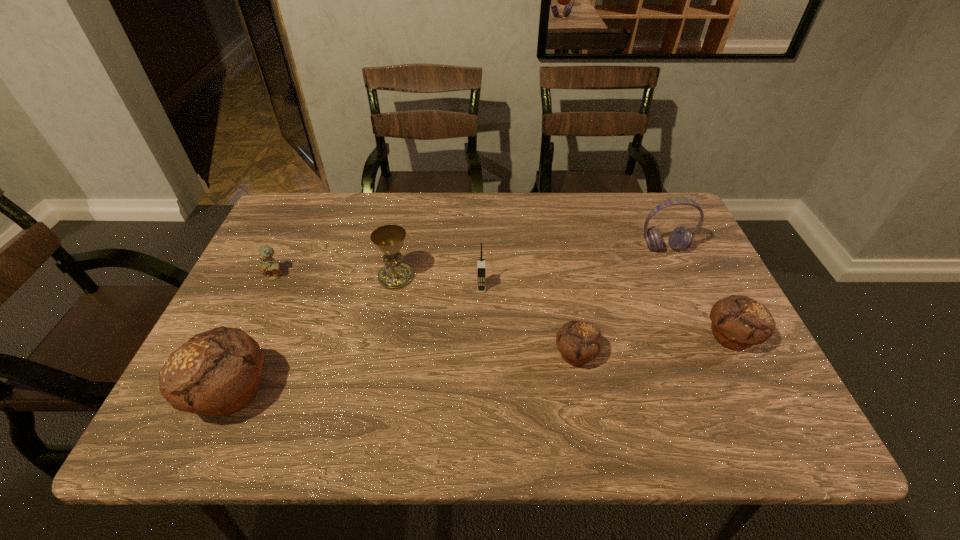
The height and width of the screenshot is (540, 960). Identify the location of vacant space located on the left of the rightmost muffin. (635, 337).

Image resolution: width=960 pixels, height=540 pixels. Identify the location of free point located on the front-facing side of the teddy bear. (248, 333).

You are a GUI agent. You are given a task and a screenshot of the screen. Output one action in this format:
    pyautogui.click(x=<x>, y=<y>)
    Task: Click on the free spot located on the front of the chalice
    
    Given the screenshot: What is the action you would take?
    pyautogui.click(x=379, y=367)

Locate an element on the screen. The width and height of the screenshot is (960, 540). free space located 0.390m on the headband and ear cups of the farthest object is located at coordinates (722, 379).

Where is `free location located 0.190m on the front-facing side of the cellular telephone`? The image size is (960, 540). free location located 0.190m on the front-facing side of the cellular telephone is located at coordinates (482, 355).

I want to click on object that is at the far edge, so click(681, 238).

The image size is (960, 540). In order to click on muffin at the left edge in this screenshot , I will do `click(216, 373)`.

Locate an element on the screen. teddy bear present at the left edge is located at coordinates (268, 266).

Find the location of a particular element. muffin that is at the right edge is located at coordinates (738, 322).

Locate an element on the screen. The image size is (960, 540). headset situated at the right edge is located at coordinates (681, 238).